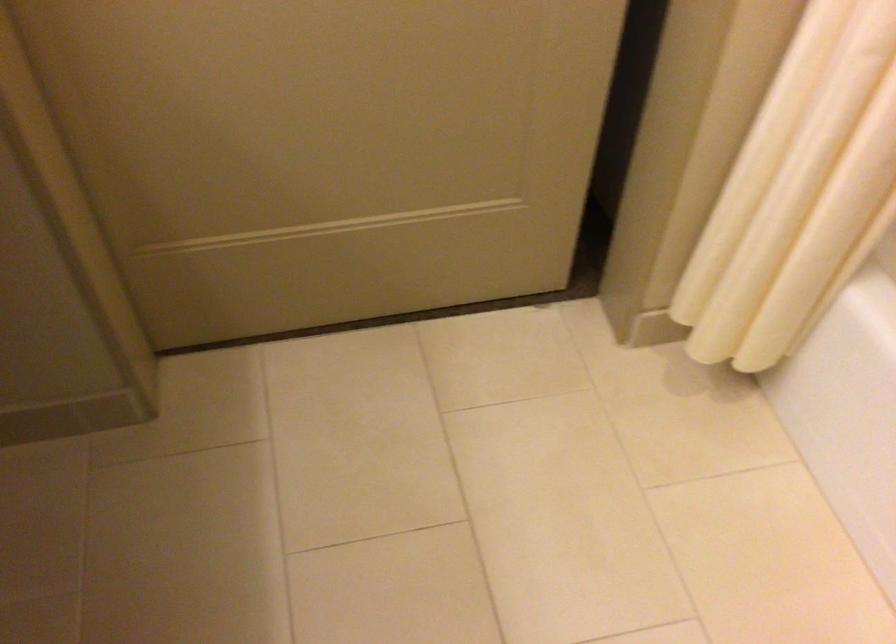
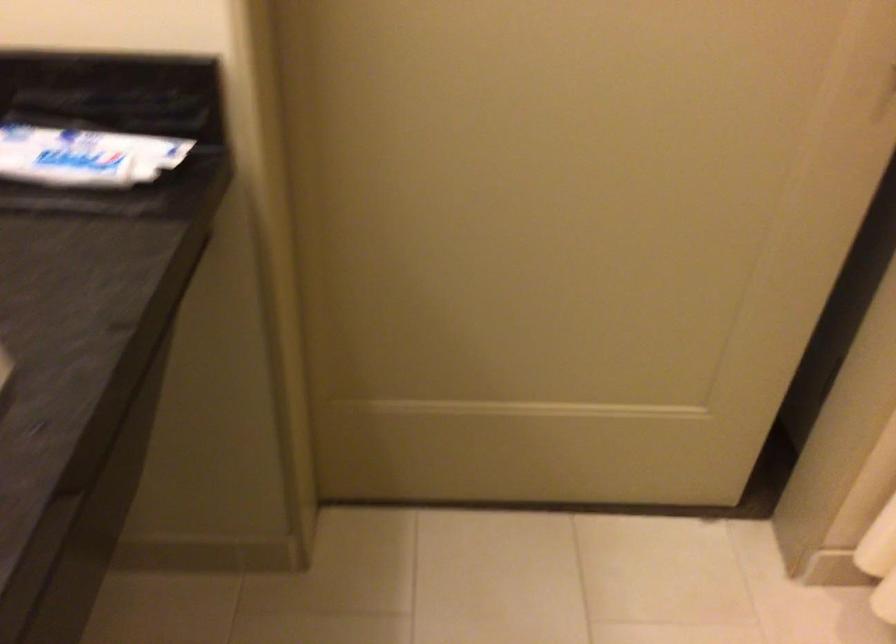
Question: Based on the continuous images, in which direction is the camera rotating? Reply with the corresponding letter.

Choices:
 (A) Left
 (B) Right
 (C) Up
 (D) Down

Answer: (C)